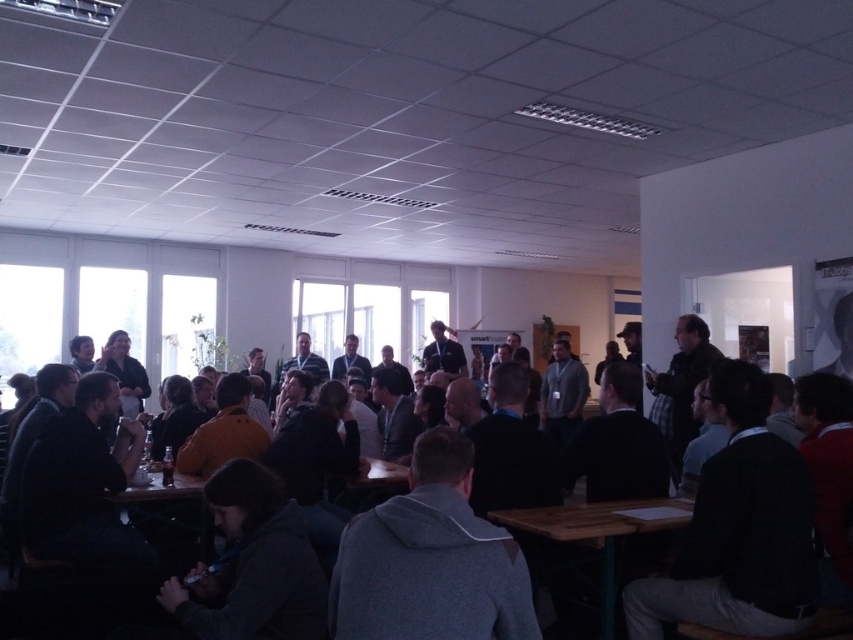
Question: Is dark gray hoodie at center below wooden table at lower center?

Choices:
 (A) yes
 (B) no

Answer: (B)

Question: Which of the following is the closest to the observer?

Choices:
 (A) (604, 602)
 (B) (849, 468)

Answer: (B)

Question: Does dark gray hoodie at center have a smaller size compared to wooden table at lower center?

Choices:
 (A) yes
 (B) no

Answer: (A)

Question: Does dark gray hoodie at center appear on the left side of wooden table at lower center?

Choices:
 (A) no
 (B) yes

Answer: (A)

Question: Which of the following is the farthest from the observer?

Choices:
 (A) (668, 522)
 (B) (834, 417)

Answer: (A)